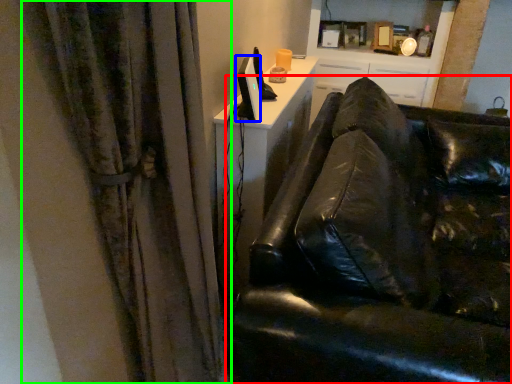
Question: Which object is positioned farthest from studio couch (highlighted by a red box)? Select from computer monitor (highlighted by a blue box) and curtain (highlighted by a green box).

Choices:
 (A) computer monitor
 (B) curtain

Answer: (A)